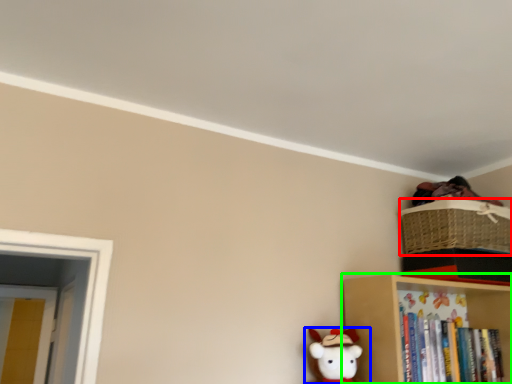
Question: Based on their relative distances, which object is nearer to basket (highlighted by a red box)? Choose from toy (highlighted by a blue box) and shelf (highlighted by a green box).

Choices:
 (A) toy
 (B) shelf

Answer: (B)